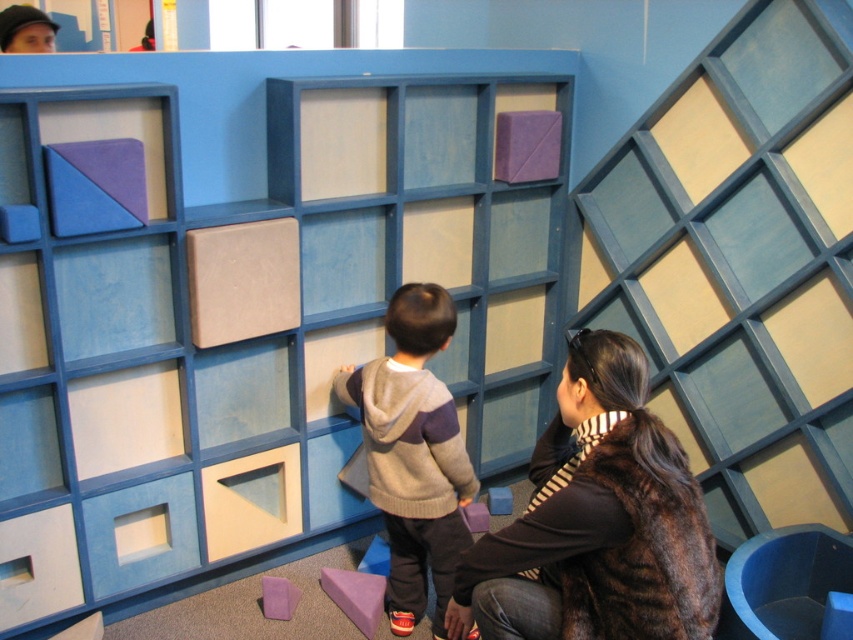
Can you confirm if purple matte triangle at upper center is thinner than purple matte cube at center?

Incorrect, purple matte triangle at upper center's width is not less than purple matte cube at center's.

Who is more distant from viewer, (9, 449) or (488, 490)?

The point (488, 490) is more distant.

Does point (6, 330) lie in front of point (509, 492)?

Yes, point (6, 330) is in front of point (509, 492).

Identify the location of purple matte triangle at upper center. Image resolution: width=853 pixels, height=640 pixels. (260, 337).

Is purple matte triangle at upper center to the right of purple foam triangle at lower center from the viewer's perspective?

In fact, purple matte triangle at upper center is to the left of purple foam triangle at lower center.

Image resolution: width=853 pixels, height=640 pixels. I want to click on purple matte triangle at upper center, so click(x=260, y=337).

Based on the photo, is purple foam triangle at lower center above purple matte cube at center?

No.

Who is taller, purple foam triangle at lower center or purple matte cube at center?

purple foam triangle at lower center

Between point (378, 598) and point (505, 500), which one is positioned behind?

Point (505, 500)

Identify the location of purple foam triangle at lower center. (357, 596).